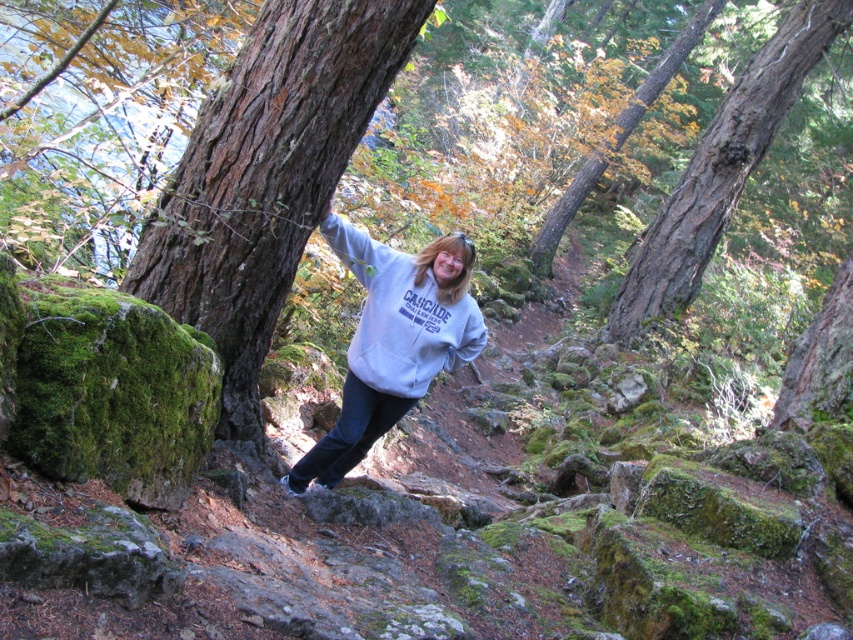
Question: Can you confirm if brown rough tree trunk at center is thinner than smooth bark tree at upper center?

Choices:
 (A) yes
 (B) no

Answer: (A)

Question: Can you confirm if brown rough tree trunk at center is smaller than smooth bark tree at upper center?

Choices:
 (A) yes
 (B) no

Answer: (A)

Question: Does light gray sweatshirt at center appear under brown rough bark at upper right?

Choices:
 (A) no
 (B) yes

Answer: (B)

Question: Which object is positioned closest to the smooth bark tree at upper center?

Choices:
 (A) light gray sweatshirt at center
 (B) brown rough tree trunk at center

Answer: (A)

Question: Among these objects, which one is nearest to the camera?

Choices:
 (A) brown rough tree trunk at center
 (B) brown rough bark at upper right

Answer: (A)

Question: Considering the real-world distances, which object is closest to the smooth bark tree at upper center?

Choices:
 (A) brown rough tree trunk at center
 (B) light gray sweatshirt at center

Answer: (B)